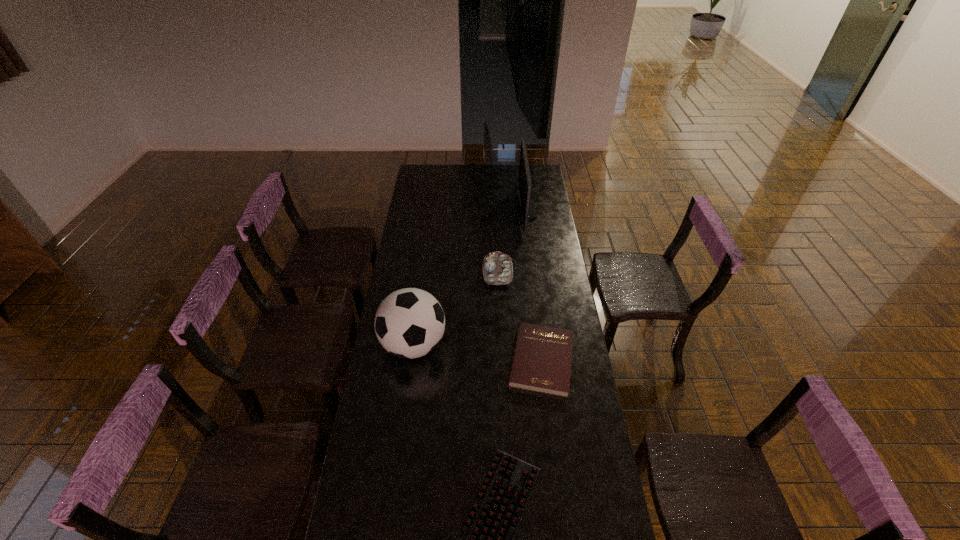
At what (x,y) coordinates should I click in order to perform the action: click on vacant area that satisfies the following two spatial constraints: 1. on the back side of the fourth nearest object; 2. on the right side of the leftmost object. Please return your answer as a coordinate pair (x, y). Looking at the image, I should click on (423, 272).